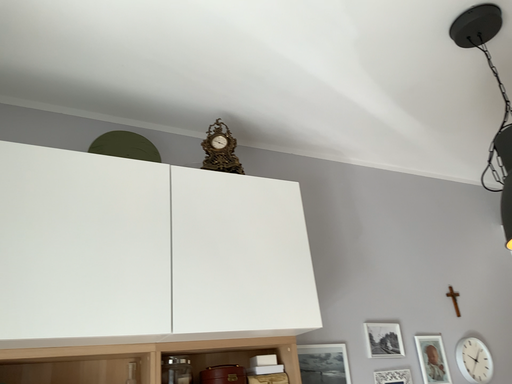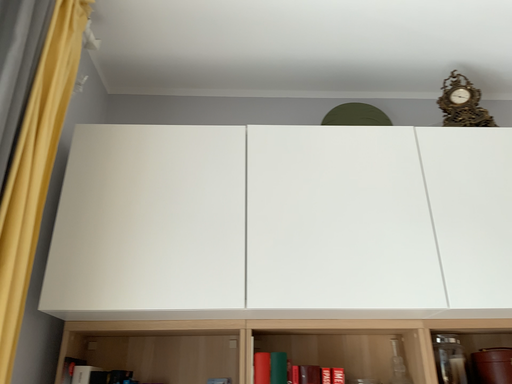
Question: Which way did the camera rotate in the video?

Choices:
 (A) rotated left
 (B) rotated right

Answer: (A)